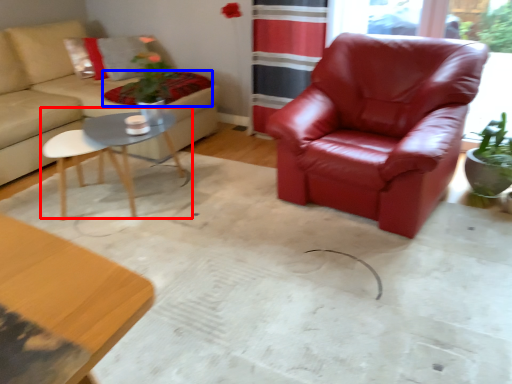
Question: Which object appears farthest to the camera in this image, coffee table (highlighted by a red box) or blanket (highlighted by a blue box)?

Choices:
 (A) coffee table
 (B) blanket

Answer: (B)